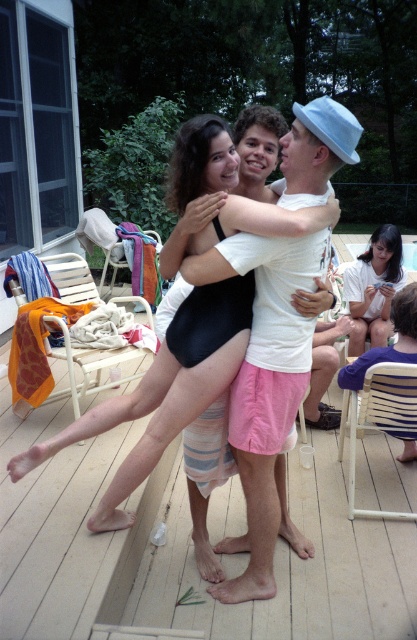
Between black matte swimsuit at center and matte white shirt at upper right, which one appears on the left side from the viewer's perspective?

Positioned to the left is black matte swimsuit at center.

What do you see at coordinates (163, 392) in the screenshot? Image resolution: width=417 pixels, height=640 pixels. I see `black matte swimsuit at center` at bounding box center [163, 392].

Where is `black matte swimsuit at center`? black matte swimsuit at center is located at coordinates (163, 392).